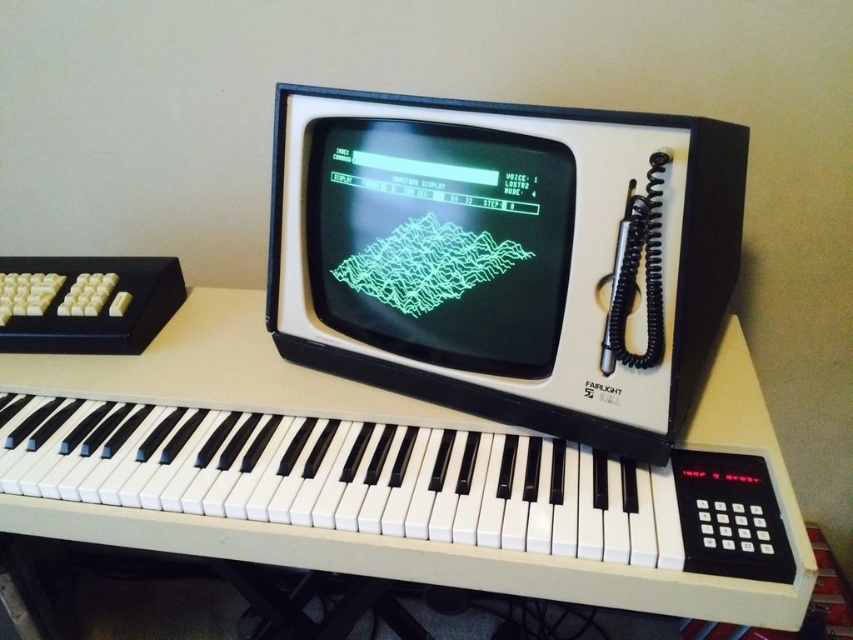
Question: Can you confirm if white plastic piano at center is positioned to the left of matte black monitor at center?

Choices:
 (A) no
 (B) yes

Answer: (B)

Question: Is white plastic piano at center below matte black monitor at center?

Choices:
 (A) yes
 (B) no

Answer: (A)

Question: Can you confirm if white plastic piano at center is smaller than matte black monitor at center?

Choices:
 (A) no
 (B) yes

Answer: (A)

Question: Which point is closer to the camera?

Choices:
 (A) (364, 218)
 (B) (59, 433)

Answer: (A)